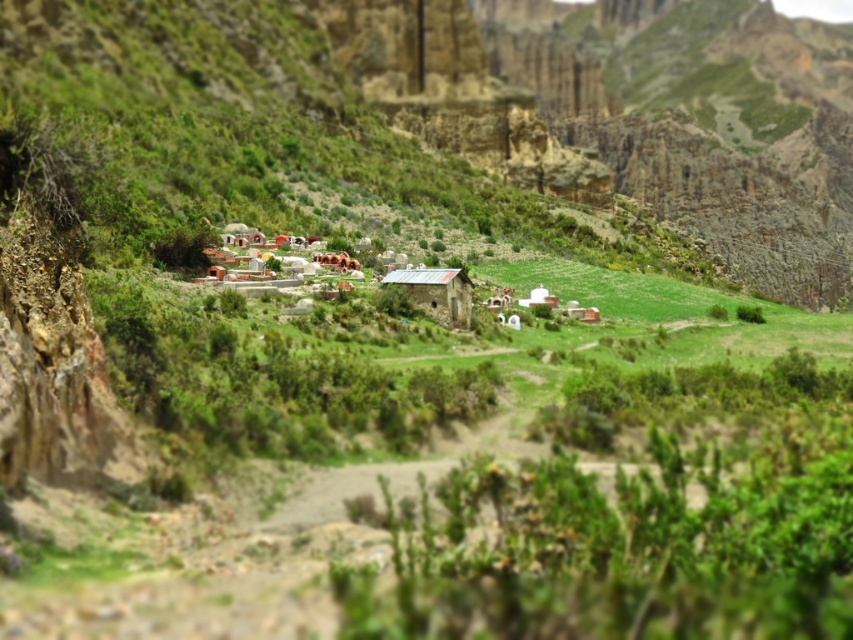
Which of these two, rustic stone hut at center or white matte hut at center, stands taller?

With more height is rustic stone hut at center.

Does rustic stone hut at center have a lesser width compared to white matte hut at center?

No.

Is point (451, 305) behind point (543, 291)?

No, (451, 305) is in front of (543, 291).

Identify the location of rustic stone hut at center. The height and width of the screenshot is (640, 853). (436, 291).

The width and height of the screenshot is (853, 640). What do you see at coordinates (434, 291) in the screenshot?
I see `white stone village at center` at bounding box center [434, 291].

Based on the photo, between white stone village at center and white clay hut at center, which one has more height?

white stone village at center is taller.

Between point (454, 276) and point (575, 307), which one is positioned in front?

Point (454, 276)

Identify the location of white stone village at center. [x=434, y=291].

Between green grassy hill at center and white matte hut at center, which one appears on the left side from the viewer's perspective?

white matte hut at center

Is point (598, 72) closer to camera compared to point (524, 300)?

No.

Does point (142, 97) lie behind point (544, 304)?

That is True.

This screenshot has height=640, width=853. Identify the location of green grassy hill at center. (520, 93).